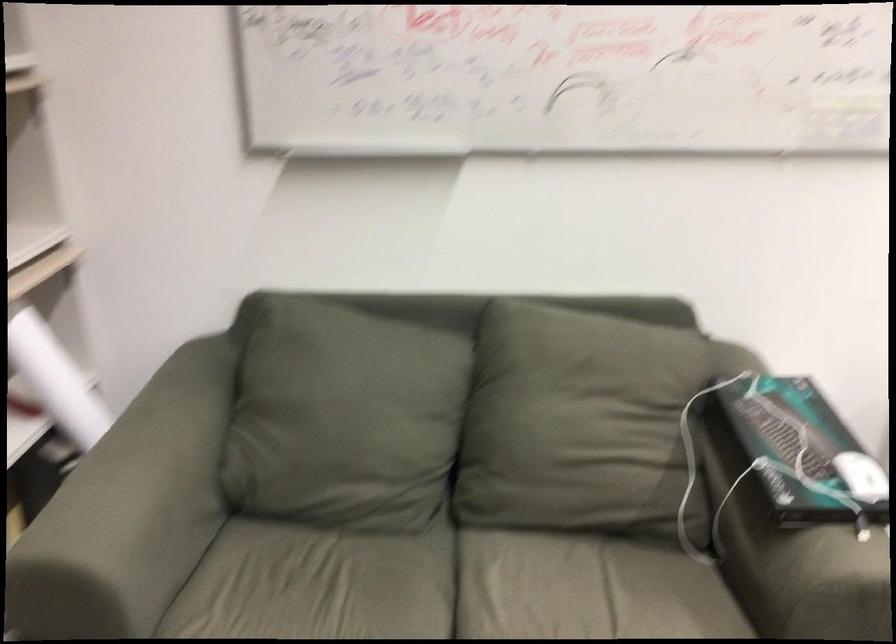
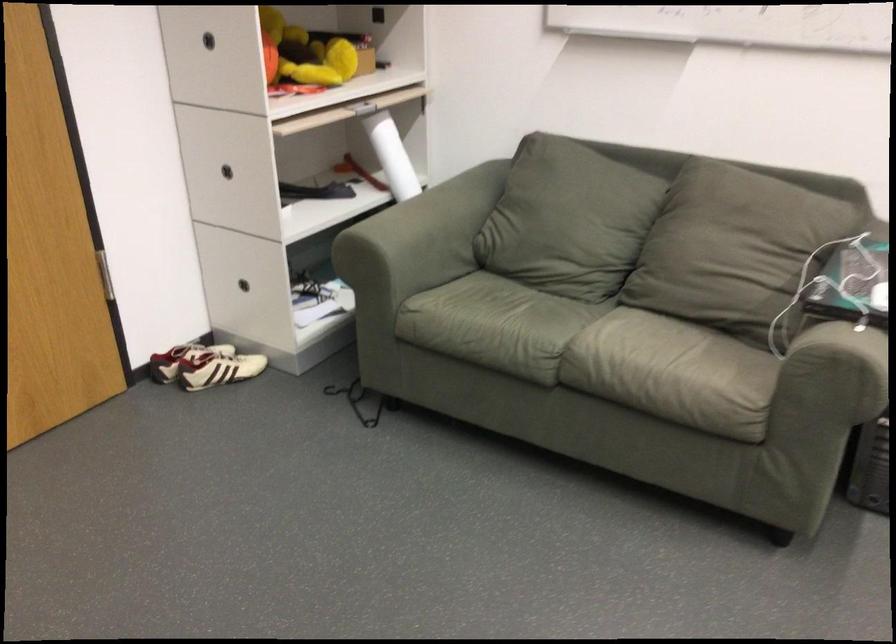
Find the pixel in the second image that matches the point at 351,442 in the first image.

(558, 232)